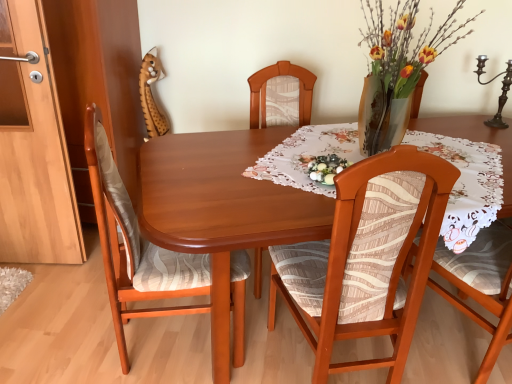
Question: Should I look upward or downward to see wooden chair with patterned fabric at center, which is counted as the second chair, starting from the left?

Choices:
 (A) up
 (B) down

Answer: (B)

Question: Is the position of matte wood cabinet at left less distant than that of floral lace tablecloth at center?

Choices:
 (A) no
 (B) yes

Answer: (A)

Question: From a real-world perspective, does matte wood cabinet at left stand above floral lace tablecloth at center?

Choices:
 (A) yes
 (B) no

Answer: (B)

Question: Is there a large distance between matte wood cabinet at left and floral lace tablecloth at center?

Choices:
 (A) no
 (B) yes

Answer: (B)

Question: From a real-world perspective, is matte wood cabinet at left positioned under floral lace tablecloth at center based on gravity?

Choices:
 (A) yes
 (B) no

Answer: (A)

Question: Does matte wood cabinet at left have a greater height compared to floral lace tablecloth at center?

Choices:
 (A) yes
 (B) no

Answer: (A)

Question: Can you confirm if matte wood cabinet at left is positioned to the right of floral lace tablecloth at center?

Choices:
 (A) no
 (B) yes

Answer: (A)

Question: Would you say polished dark brown candle holder at upper right is outside wooden chair with patterned fabric at center, positioned as the 1th chair in right-to-left order?

Choices:
 (A) no
 (B) yes

Answer: (B)

Question: Considering the relative sizes of polished dark brown candle holder at upper right and wooden chair with patterned fabric at center, positioned as the 1th chair in right-to-left order, in the image provided, is polished dark brown candle holder at upper right thinner than wooden chair with patterned fabric at center, positioned as the 1th chair in right-to-left order,?

Choices:
 (A) no
 (B) yes

Answer: (B)

Question: From the image's perspective, is polished dark brown candle holder at upper right beneath wooden chair with patterned fabric at center, positioned as the 1th chair in right-to-left order?

Choices:
 (A) yes
 (B) no

Answer: (B)

Question: Does polished dark brown candle holder at upper right have a larger size compared to wooden chair with patterned fabric at center, positioned as the 1th chair in right-to-left order?

Choices:
 (A) yes
 (B) no

Answer: (B)

Question: Can you confirm if polished dark brown candle holder at upper right is wider than wooden chair with patterned fabric at center, positioned as the 1th chair in right-to-left order?

Choices:
 (A) no
 (B) yes

Answer: (A)

Question: Is wooden chair with patterned fabric at center, which is counted as the second chair, starting from the left, completely or partially inside polished dark brown candle holder at upper right?

Choices:
 (A) no
 (B) yes

Answer: (A)

Question: Can you confirm if wooden chair at left, which is the second chair in right-to-left order, is taller than matte wood cabinet at left?

Choices:
 (A) no
 (B) yes

Answer: (A)